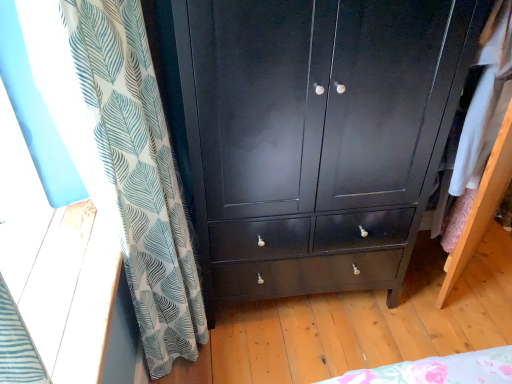
Question: Considering the relative positions of glossy black cabinet at center and white leaf-patterned curtain at left in the image provided, is glossy black cabinet at center to the left of white leaf-patterned curtain at left from the viewer's perspective?

Choices:
 (A) no
 (B) yes

Answer: (A)

Question: Is glossy black cabinet at center not close to white leaf-patterned curtain at left?

Choices:
 (A) yes
 (B) no

Answer: (B)

Question: Is glossy black cabinet at center thinner than white leaf-patterned curtain at left?

Choices:
 (A) yes
 (B) no

Answer: (B)

Question: Would you say glossy black cabinet at center is outside white leaf-patterned curtain at left?

Choices:
 (A) no
 (B) yes

Answer: (B)

Question: Is glossy black cabinet at center oriented away from white leaf-patterned curtain at left?

Choices:
 (A) yes
 (B) no

Answer: (B)

Question: Could you tell me if glossy black cabinet at center is turned towards white leaf-patterned curtain at left?

Choices:
 (A) no
 (B) yes

Answer: (A)

Question: Is white leaf-patterned curtain at left positioned beyond the bounds of glossy black cabinet at center?

Choices:
 (A) yes
 (B) no

Answer: (A)

Question: Is white leaf-patterned curtain at left at the left side of glossy black cabinet at center?

Choices:
 (A) yes
 (B) no

Answer: (A)

Question: From the image's perspective, would you say white leaf-patterned curtain at left is shown under glossy black cabinet at center?

Choices:
 (A) no
 (B) yes

Answer: (B)

Question: Considering the relative sizes of white leaf-patterned curtain at left and glossy black cabinet at center in the image provided, is white leaf-patterned curtain at left shorter than glossy black cabinet at center?

Choices:
 (A) yes
 (B) no

Answer: (B)

Question: Is white leaf-patterned curtain at left touching glossy black cabinet at center?

Choices:
 (A) yes
 (B) no

Answer: (B)

Question: Does white leaf-patterned curtain at left come behind glossy black cabinet at center?

Choices:
 (A) no
 (B) yes

Answer: (A)

Question: Relative to white leaf-patterned curtain at left, is glossy black cabinet at center in front or behind?

Choices:
 (A) behind
 (B) front

Answer: (A)